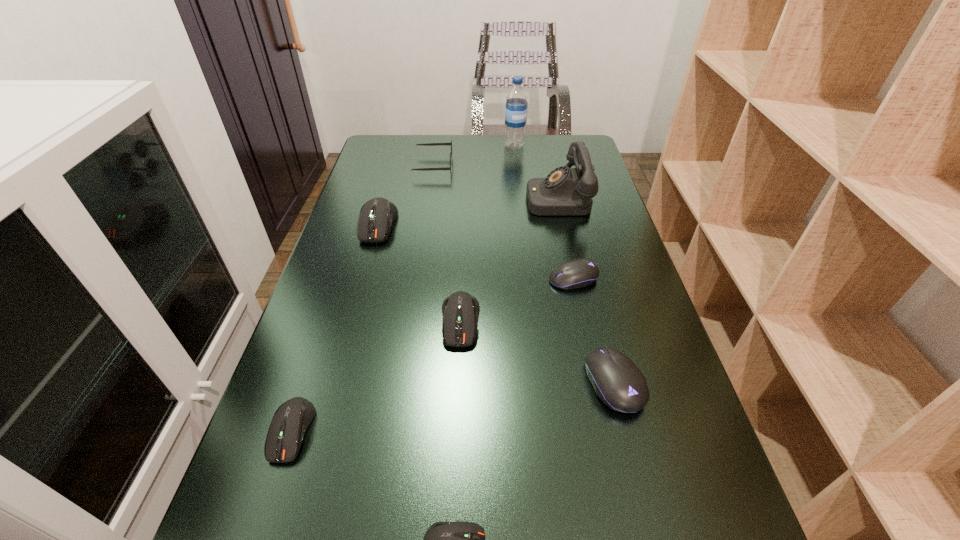
Locate an element on the screen. vacant space situated 0.210m on the button of the second biggest dark computer equipment is located at coordinates (455, 450).

Find the location of a particular element. The image size is (960, 540). vacant space located on the back of the nearer black computer mouse is located at coordinates (577, 238).

I want to click on vacant space positioned 0.180m on the left of the second farthest computer equipment, so click(472, 279).

Locate an element on the screen. This screenshot has height=540, width=960. water bottle that is at the far edge is located at coordinates (516, 101).

Locate an element on the screen. sunglasses present at the far edge is located at coordinates (427, 144).

This screenshot has height=540, width=960. I want to click on sunglasses at the left edge, so click(427, 144).

At what (x,y) coordinates should I click in order to perform the action: click on telephone that is positioned at the right edge. Please return your answer as a coordinate pair (x, y). The image size is (960, 540). Looking at the image, I should click on click(565, 191).

Identify the location of object present at the far left corner. The height and width of the screenshot is (540, 960). (427, 144).

At what (x,y) coordinates should I click in order to perform the action: click on vacant region at the far edge of the desktop. Please return your answer as a coordinate pair (x, y). The width and height of the screenshot is (960, 540). Looking at the image, I should click on (529, 151).

In the image, there is a desktop. Where is `free space at the left edge`? This screenshot has height=540, width=960. free space at the left edge is located at coordinates (309, 359).